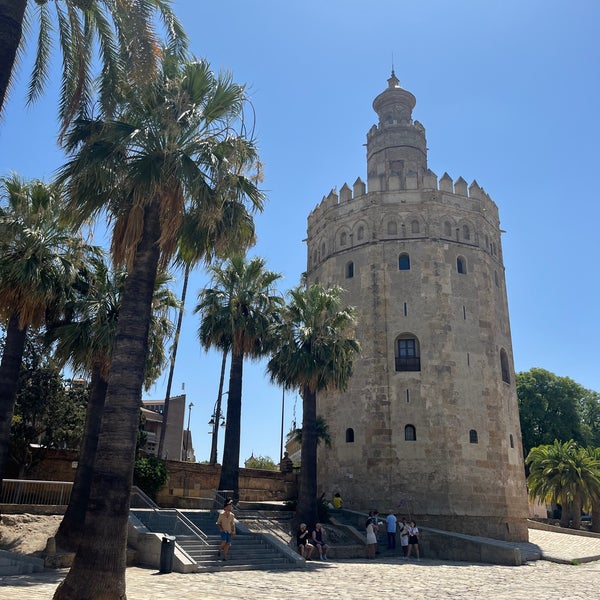
Find the location of a particular element. The width and height of the screenshot is (600, 600). stone walls is located at coordinates (185, 472), (45, 461), (271, 477).